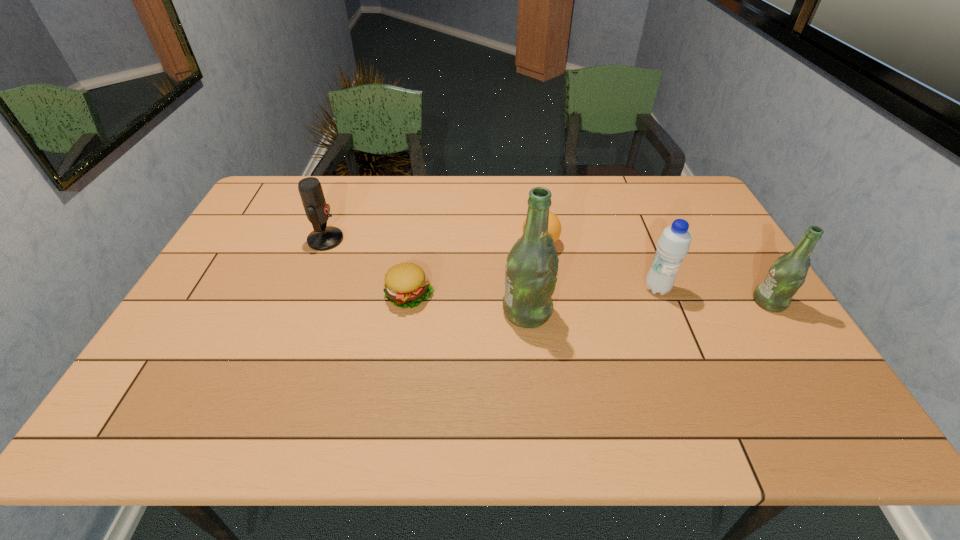
At what (x,y) coordinates should I click in order to perform the action: click on vacant spot to place a beer bottle on the left. Please return your answer as a coordinate pair (x, y). The height and width of the screenshot is (540, 960). Looking at the image, I should click on (275, 321).